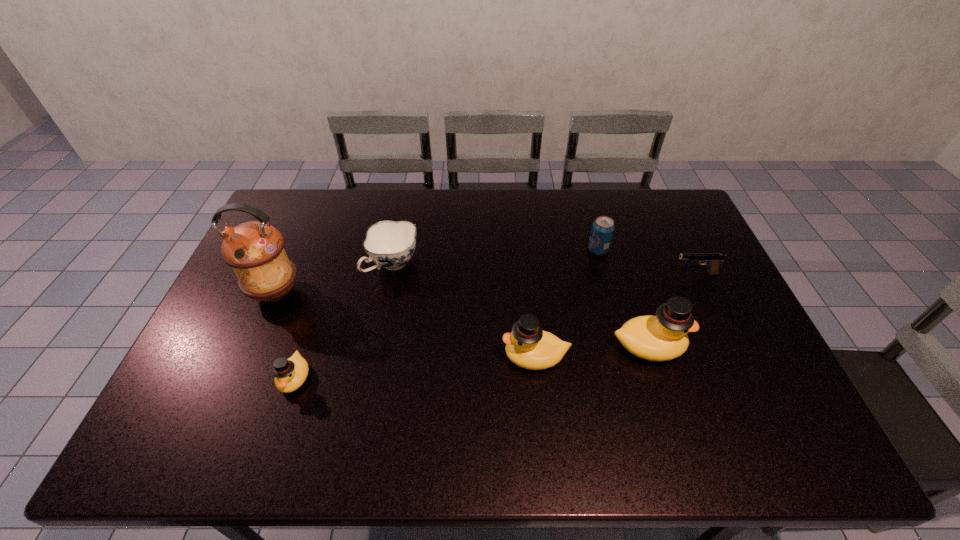
The width and height of the screenshot is (960, 540). I want to click on free space between the third object from left to right and the second tallest duck, so click(464, 310).

Select which object is the third closest to the shortest duck. Please provide its 2D coordinates. Your answer should be formatted as a tuple, i.e. [(x, y)], where the tuple contains the x and y coordinates of a point satisfying the conditions above.

[(528, 346)]

Identify which object is the nearest to the third tallest object. Please provide its 2D coordinates. Your answer should be formatted as a tuple, i.e. [(x, y)], where the tuple contains the x and y coordinates of a point satisfying the conditions above.

[(663, 337)]

Where is `the closest duck to the rightmost duck`? the closest duck to the rightmost duck is located at coordinates (528, 346).

Where is `duck that is the third closest to the fifth object from right to left`? This screenshot has height=540, width=960. duck that is the third closest to the fifth object from right to left is located at coordinates (663, 337).

Find the location of a particular element. vacant space that satisfies the following two spatial constraints: 1. at the muzzle of the pistol; 2. on the front-facing side of the shortest duck is located at coordinates (745, 378).

The height and width of the screenshot is (540, 960). I want to click on free space in the image that satisfies the following two spatial constraints: 1. on the front-facing side of the second tallest duck; 2. on the front-facing side of the leftmost duck, so click(x=538, y=378).

Find the location of `vacant space that satisfies the following two spatial constraints: 1. at the muzzle of the pistol; 2. on the front-facing side of the shortest duck`. vacant space that satisfies the following two spatial constraints: 1. at the muzzle of the pistol; 2. on the front-facing side of the shortest duck is located at coordinates (745, 378).